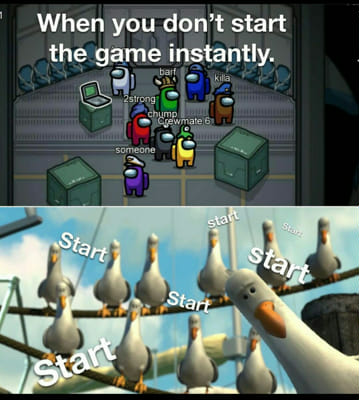
At what (x,y) coordinates should I click in order to perform the action: click on crate. Please return your answer as a coordinate pair (x, y). The image size is (359, 400). Looking at the image, I should click on (74, 188), (94, 115), (236, 146).